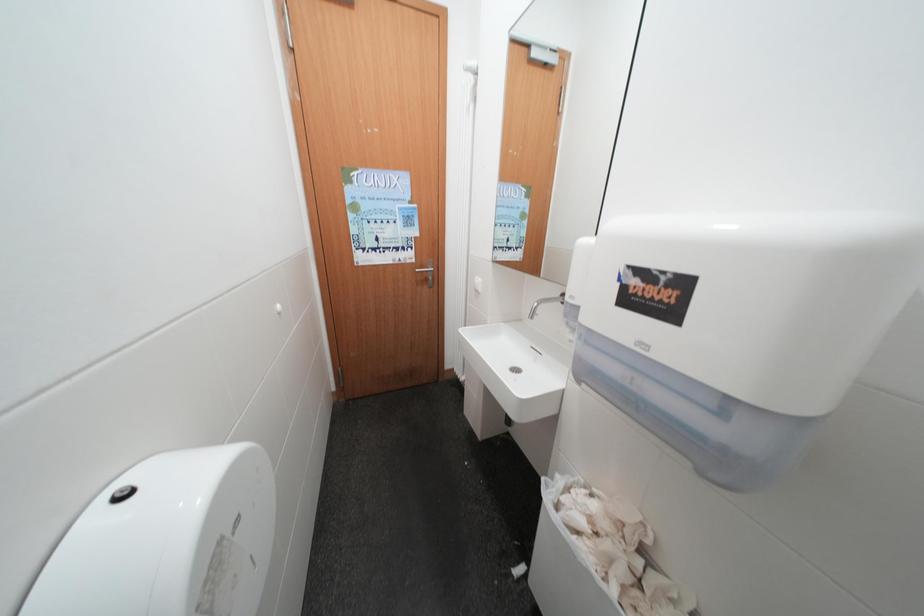
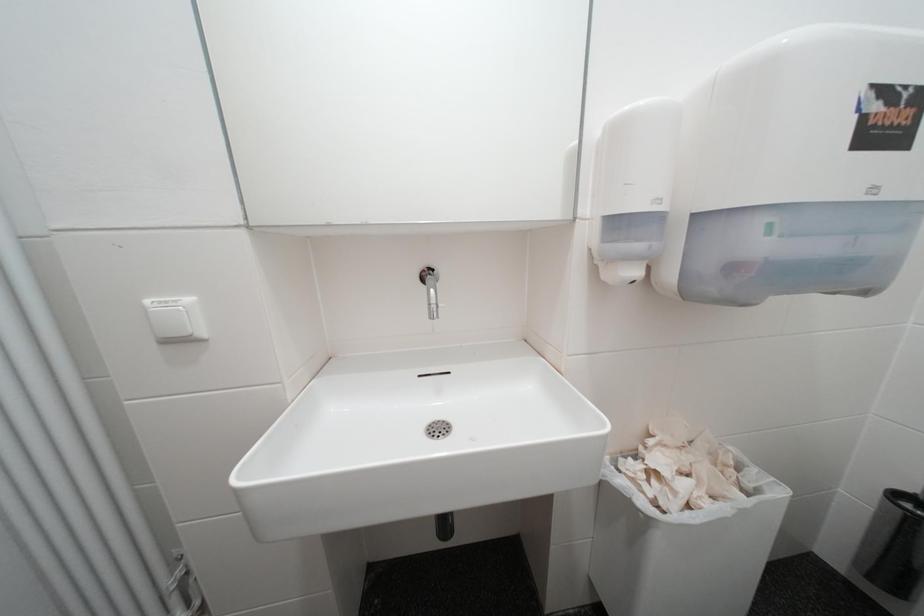
Question: The camera is either moving clockwise (left) or counter-clockwise (right) around the object. The first image is from the beginning of the video and the second image is from the end. Is the camera moving left or right when shooting the video?

Choices:
 (A) Left
 (B) Right

Answer: (A)